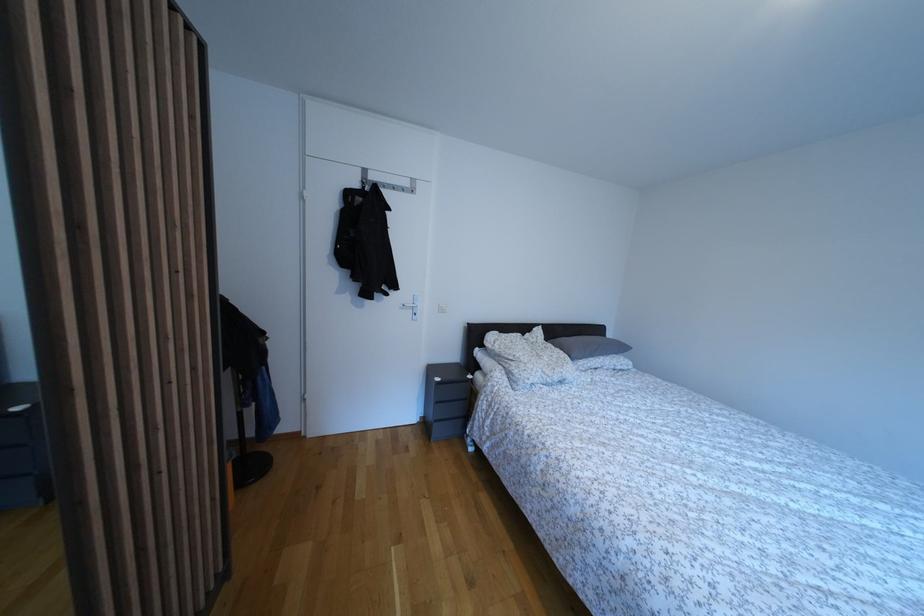
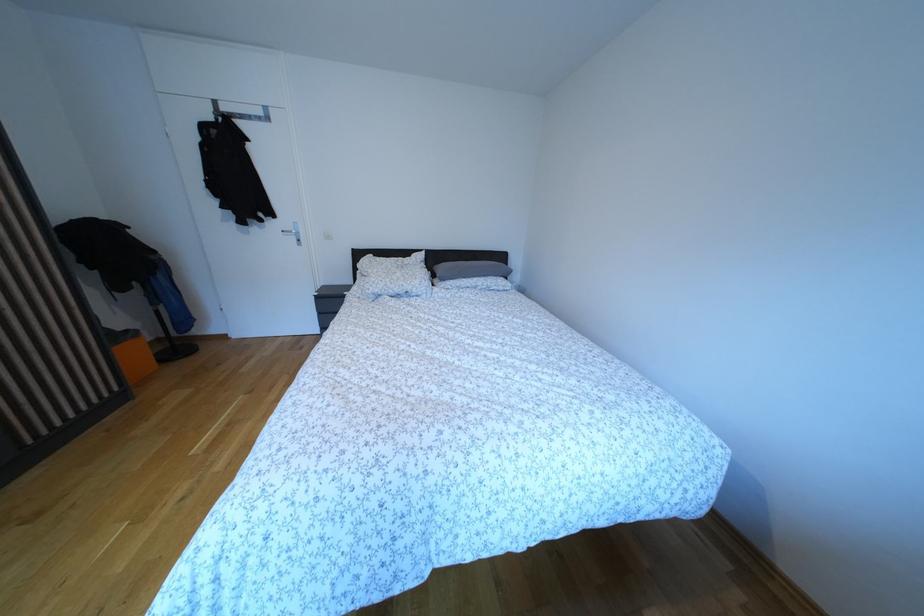
The point at (553, 363) is marked in the first image. Where is the corresponding point in the second image?

(406, 281)